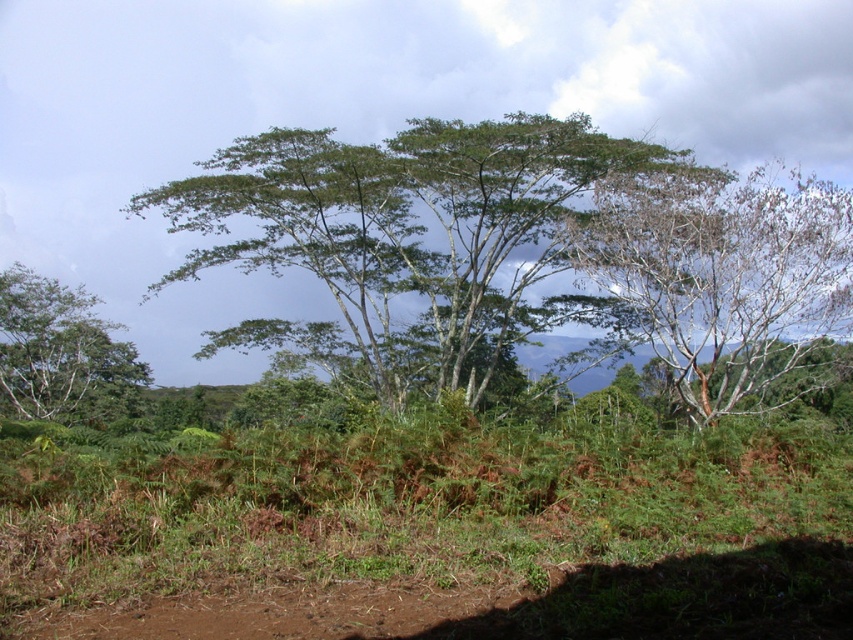
You are an environmental scientist observing this tropical landscape. You notice the bare branches tree at right and the green leafy tree at left. Which tree is positioned higher in the image?

The bare branches tree at right is positioned higher in the image than the green leafy tree at left.

You are standing at the center of the image and want to walk towards the green leafy tree at center. Which direction should you move?

The green leafy tree at center is already at the center of the image, so you are already facing it. You don not need to move in any direction.